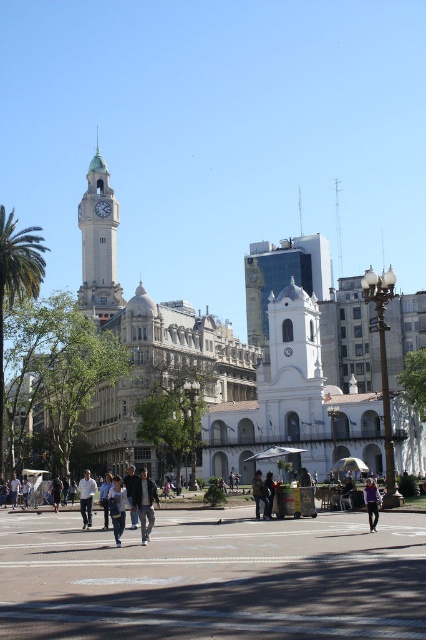
Between point (363, 573) and point (261, 496), which one is positioned behind?

Positioned behind is point (261, 496).

Consider the image. Can you confirm if concrete pavement at center is thinner than khaki fabric jacket at center?

No, concrete pavement at center is not thinner than khaki fabric jacket at center.

The image size is (426, 640). Identify the location of concrete pavement at center. (213, 579).

The image size is (426, 640). I want to click on concrete pavement at center, so click(213, 579).

Who is more distant from viewer, (117, 486) or (259, 492)?

The point (259, 492) is behind.

Is point (111, 492) closer to camera compared to point (256, 513)?

Yes, it is.

Who is more forward, (120, 499) or (256, 500)?

Point (120, 499)

Find the location of a particular element. denim jacket at center is located at coordinates (118, 508).

Can you confirm if white cotton shirt at center is positioned below dark blue jeans at center?

Incorrect, white cotton shirt at center is not positioned below dark blue jeans at center.

Which is behind, point (92, 500) or point (55, 488)?

Positioned behind is point (55, 488).

Identify the location of white cotton shirt at center. (86, 497).